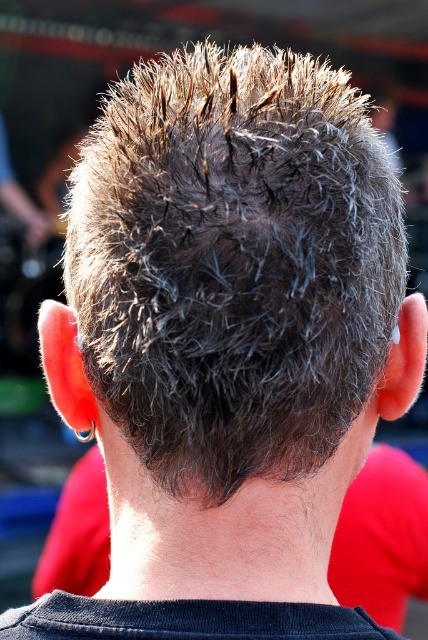
You are a hair stylist who needs to style both the dark brown spiky hair at center and the dark gray hair at center. Since you can only work on one at a time, which one should you start with to minimize the distance you need to move between them?

The dark brown spiky hair at center and dark gray hair at center are 2.25 meters apart, so you can start with either one since the distance between them is fixed.

You are a hairstylist trying to determine the best product to use for the dark brown spiky hair at center and dark gray hair at center. Given their spatial relationship, which hair type might require a stronger hold product?

The dark brown spiky hair at center occupies less space than dark gray hair at center, so the dark gray hair at center might require a stronger hold product to maintain its spiky style.

You are a hair stylist trying to style the dark brown spiky hair at center. You need to place a decorative hairpin at coordinate point 0.412, 0.547. Is this the correct position for the hairpin?

Yes, the dark brown spiky hair at center is located at point [234,262], so placing the hairpin there would be correct.